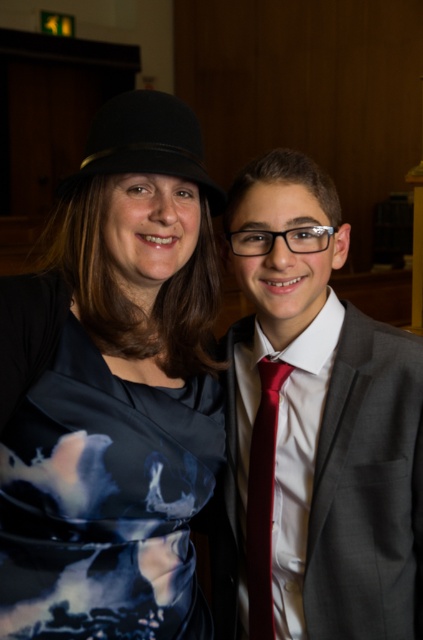
Question: Considering the real-world distances, which object is closest to the dark blue satin dress at center?

Choices:
 (A) black felt fedora at upper left
 (B) matte gray suit at right

Answer: (B)

Question: Can you confirm if matte gray suit at right is thinner than dark blue satin dress at center?

Choices:
 (A) no
 (B) yes

Answer: (A)

Question: Which of the following is the closest to the observer?

Choices:
 (A) dark blue satin dress at center
 (B) black felt fedora at upper left
 (C) matte gray suit at right

Answer: (A)

Question: Which point is farther to the camera?

Choices:
 (A) shiny red tie at center
 (B) matte gray suit at right

Answer: (A)

Question: Observing the image, what is the correct spatial positioning of matte gray suit at right in reference to dark blue satin dress at center?

Choices:
 (A) left
 (B) right

Answer: (B)

Question: Does dark blue satin dress at center come in front of black felt fedora at upper left?

Choices:
 (A) yes
 (B) no

Answer: (A)